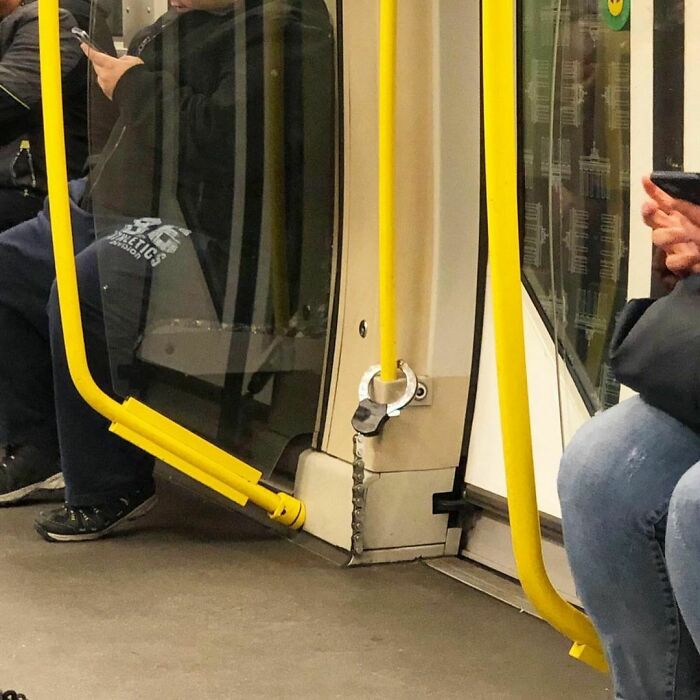
The width and height of the screenshot is (700, 700). I want to click on doors, so point(595,84).